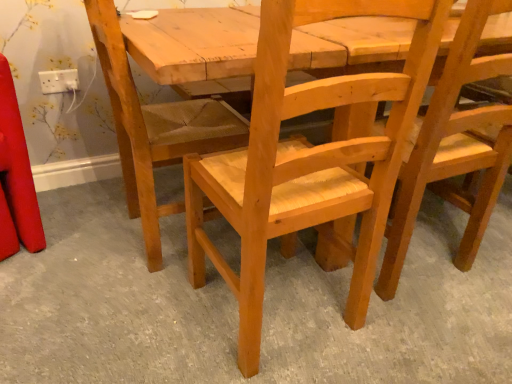
The height and width of the screenshot is (384, 512). In order to click on free location in front of natural wood chair at center, which ranks as the third chair in left-to-right order in this screenshot , I will do `click(438, 332)`.